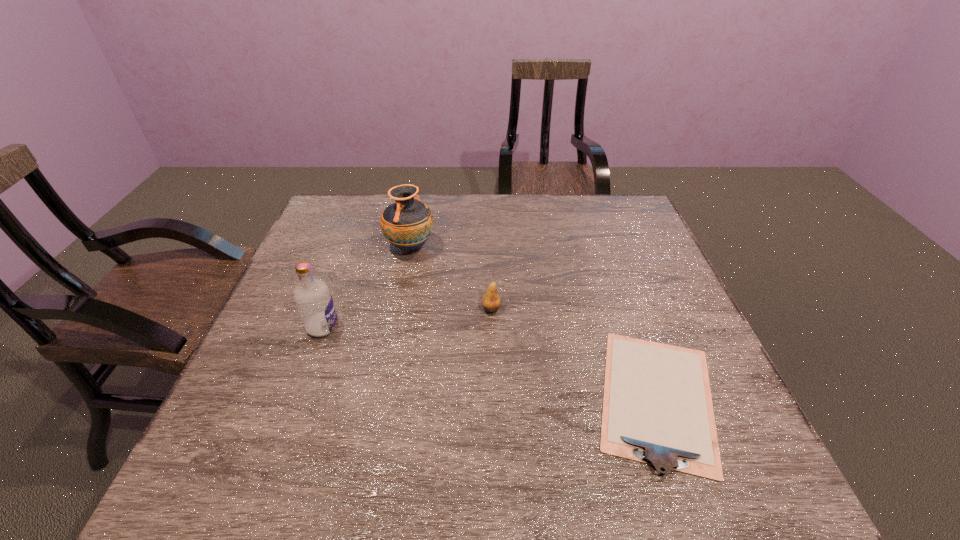
This screenshot has width=960, height=540. What are the coordinates of `vodka` in the screenshot? It's located at (314, 302).

Where is `pottery`? Image resolution: width=960 pixels, height=540 pixels. pottery is located at coordinates (407, 224).

Identify the location of the farthest object. (407, 224).

Identify the location of pear. The image size is (960, 540). (491, 302).

At what (x,y) coordinates should I click in order to perform the action: click on the third tallest object. Please return your answer as a coordinate pair (x, y). This screenshot has height=540, width=960. Looking at the image, I should click on (491, 302).

Where is `the shortest object`? The width and height of the screenshot is (960, 540). the shortest object is located at coordinates (657, 407).

The width and height of the screenshot is (960, 540). Find the location of `the rightmost object`. the rightmost object is located at coordinates (657, 407).

This screenshot has width=960, height=540. I want to click on free space located 0.260m on the label of the vodka, so click(x=446, y=327).

Locate an element on the screen. vacant space located on the front of the farthest object is located at coordinates (388, 359).

Where is `vacant space located 0.050m on the right of the second object from right to left`? vacant space located 0.050m on the right of the second object from right to left is located at coordinates (520, 309).